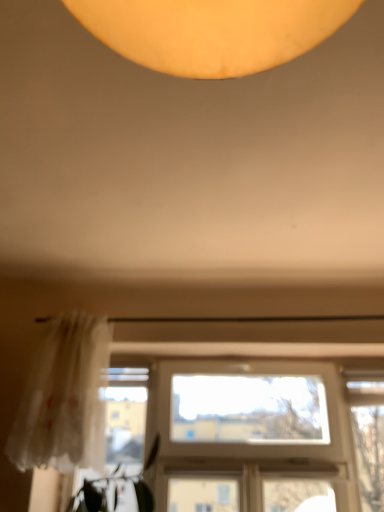
Question: Is translucent white curtain at left at the back of clear glass window at center?

Choices:
 (A) yes
 (B) no

Answer: (B)

Question: From a real-world perspective, is clear glass window at center positioned under translucent white curtain at left based on gravity?

Choices:
 (A) no
 (B) yes

Answer: (B)

Question: Does clear glass window at center have a larger size compared to translucent white curtain at left?

Choices:
 (A) no
 (B) yes

Answer: (B)

Question: From the image's perspective, is clear glass window at center under translucent white curtain at left?

Choices:
 (A) yes
 (B) no

Answer: (A)

Question: Is clear glass window at center positioned beyond the bounds of translucent white curtain at left?

Choices:
 (A) yes
 (B) no

Answer: (A)

Question: Does clear glass window at center have a lesser height compared to translucent white curtain at left?

Choices:
 (A) yes
 (B) no

Answer: (B)

Question: Is translucent white curtain at left bigger than clear glass window at center?

Choices:
 (A) no
 (B) yes

Answer: (A)

Question: Is translucent white curtain at left smaller than clear glass window at center?

Choices:
 (A) yes
 (B) no

Answer: (A)

Question: From a real-world perspective, is translucent white curtain at left positioned under clear glass window at center based on gravity?

Choices:
 (A) no
 (B) yes

Answer: (A)

Question: Would you say translucent white curtain at left contains clear glass window at center?

Choices:
 (A) yes
 (B) no

Answer: (B)

Question: Is translucent white curtain at left further to the viewer compared to clear glass window at center?

Choices:
 (A) yes
 (B) no

Answer: (B)

Question: Would you say translucent white curtain at left is outside clear glass window at center?

Choices:
 (A) no
 (B) yes

Answer: (B)

Question: Is clear glass window at center taller or shorter than translucent white curtain at left?

Choices:
 (A) tall
 (B) short

Answer: (A)